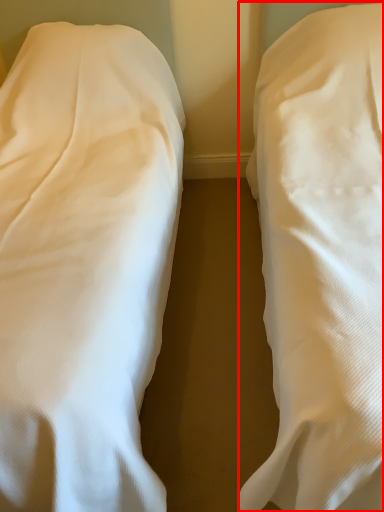
Question: Considering the relative positions of bed (annotated by the red box) and bed in the image provided, where is bed (annotated by the red box) located with respect to the staircase?

Choices:
 (A) right
 (B) left

Answer: (A)